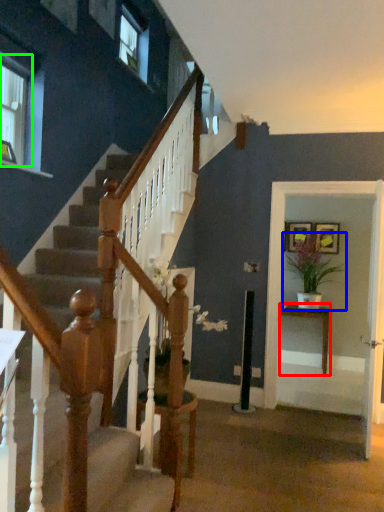
Question: Which object is the closest to the table (highlighted by a red box)? Choose among these: houseplant (highlighted by a blue box) or window (highlighted by a green box).

Choices:
 (A) houseplant
 (B) window

Answer: (A)